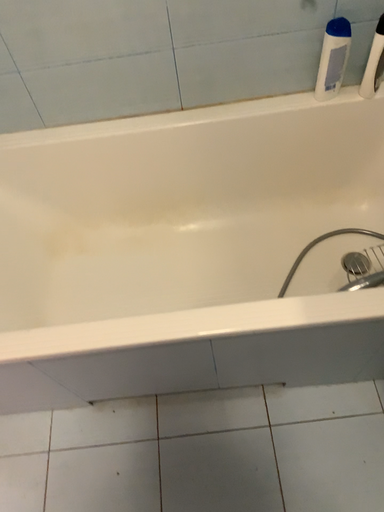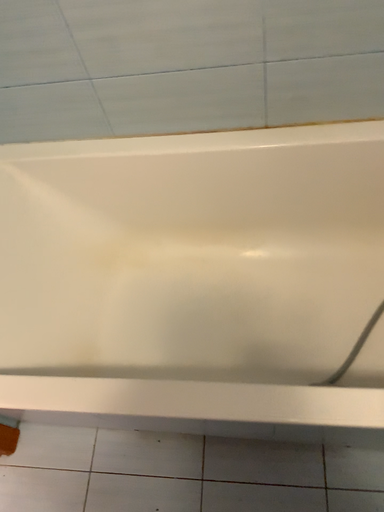
Question: Which way did the camera rotate in the video?

Choices:
 (A) rotated right
 (B) rotated left

Answer: (B)